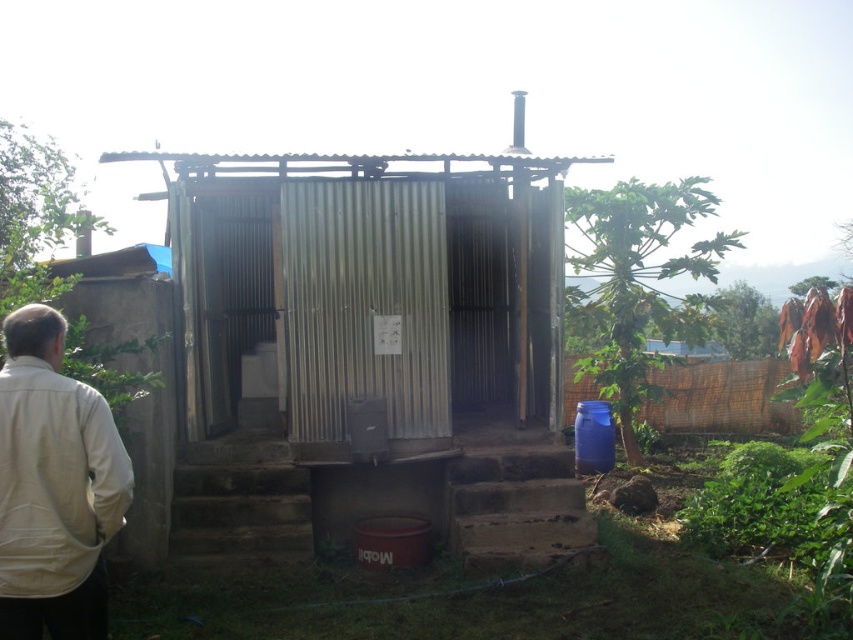
Question: Does corrugated metal hut at center have a larger size compared to beige fabric jacket at lower left?

Choices:
 (A) no
 (B) yes

Answer: (B)

Question: Which point is closer to the camera?

Choices:
 (A) (64, 488)
 (B) (474, 237)

Answer: (A)

Question: Is corrugated metal hut at center thinner than beige fabric jacket at lower left?

Choices:
 (A) yes
 (B) no

Answer: (B)

Question: Which of the following is the closest to the observer?

Choices:
 (A) beige fabric jacket at lower left
 (B) corrugated metal hut at center

Answer: (A)

Question: Considering the relative positions of corrugated metal hut at center and beige fabric jacket at lower left in the image provided, where is corrugated metal hut at center located with respect to beige fabric jacket at lower left?

Choices:
 (A) above
 (B) below

Answer: (A)